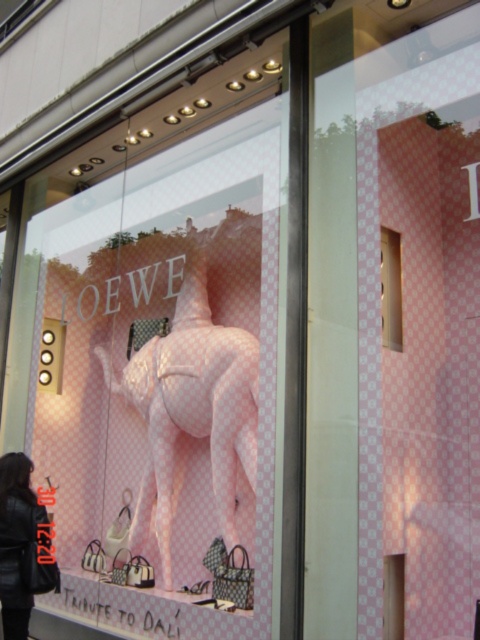
Question: Does black leather jacket at lower left have a greater width compared to pink glossy box at upper right?

Choices:
 (A) yes
 (B) no

Answer: (A)

Question: Which of the following is the closest to the observer?

Choices:
 (A) (253, 342)
 (B) (399, 275)
 (C) (12, 598)

Answer: (C)

Question: Which object is positioned closest to the pink glossy box at upper right?

Choices:
 (A) black leather jacket at lower left
 (B) pink checkered mannequin at center

Answer: (B)

Question: Does pink checkered mannequin at center appear over black leather jacket at lower left?

Choices:
 (A) yes
 (B) no

Answer: (A)

Question: Is pink checkered mannequin at center closer to camera compared to pink glossy box at upper right?

Choices:
 (A) yes
 (B) no

Answer: (B)

Question: Considering the real-world distances, which object is farthest from the pink glossy box at upper right?

Choices:
 (A) black leather jacket at lower left
 (B) pink checkered mannequin at center

Answer: (A)